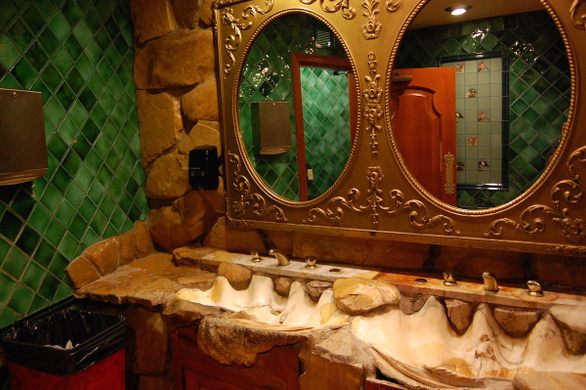
Find the location of a particular element. This screenshot has width=586, height=390. faucet knobs is located at coordinates (255, 255), (310, 260), (449, 275), (534, 284).